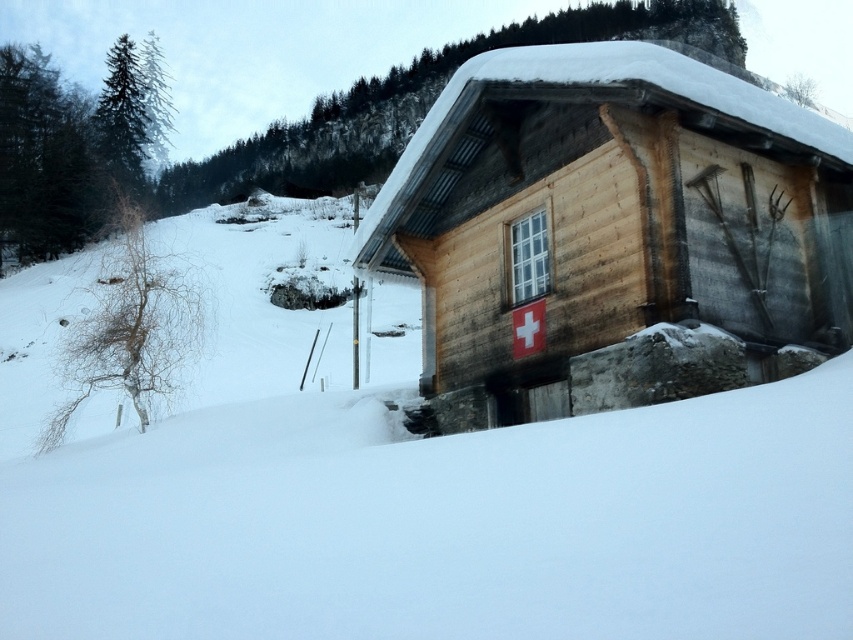
Is wooden log cabin at center closer to the viewer compared to wooden cabin at center?

Yes, wooden log cabin at center is closer to the viewer.

Locate an element on the screen. wooden log cabin at center is located at coordinates (612, 234).